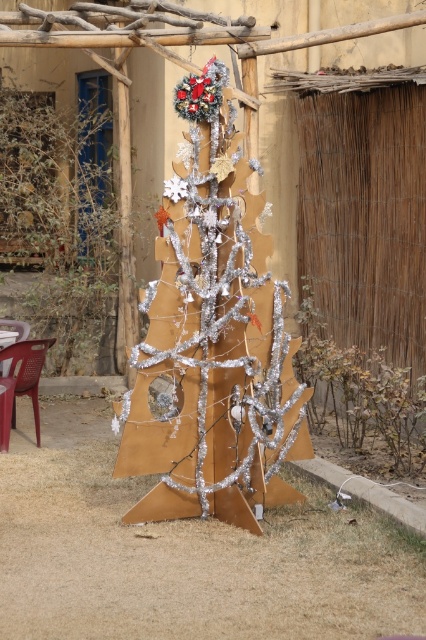
Question: Among these points, which one is farthest from the camera?

Choices:
 (A) (77, 240)
 (B) (20, 38)
 (C) (192, 484)

Answer: (A)

Question: Which of the following is the closest to the observer?

Choices:
 (A) silver metallic christmas tree at center
 (B) shiny silver tree at center
 (C) silver metallic tree at center

Answer: (A)

Question: Can you confirm if silver metallic christmas tree at center is thinner than silver metallic tree at center?

Choices:
 (A) no
 (B) yes

Answer: (B)

Question: Can you confirm if shiny silver tree at center is smaller than silver metallic tree at center?

Choices:
 (A) yes
 (B) no

Answer: (A)

Question: Can you confirm if silver metallic christmas tree at center is positioned to the right of shiny silver tree at center?

Choices:
 (A) no
 (B) yes

Answer: (B)

Question: Which point appears farthest from the camera in this image?

Choices:
 (A) (83, 13)
 (B) (112, 349)

Answer: (B)